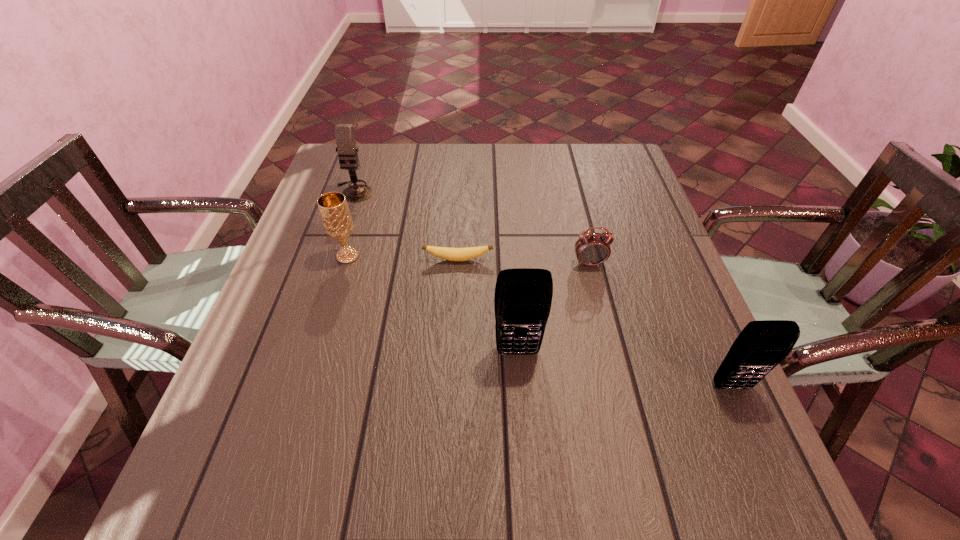
This screenshot has width=960, height=540. Find the location of `free spot between the microphone and the banana`. free spot between the microphone and the banana is located at coordinates (406, 225).

Where is `free point between the farther cellular telephone and the second object from right to left`? The width and height of the screenshot is (960, 540). free point between the farther cellular telephone and the second object from right to left is located at coordinates (554, 308).

The width and height of the screenshot is (960, 540). What are the coordinates of `vacant space that's between the taller cellular telephone and the right cellular telephone` in the screenshot? It's located at (625, 369).

Locate an element on the screen. empty location between the microphone and the farther cellular telephone is located at coordinates (436, 272).

Locate which object is the closest to the chalice. Please provide its 2D coordinates. Your answer should be formatted as a tuple, i.e. [(x, y)], where the tuple contains the x and y coordinates of a point satisfying the conditions above.

[(452, 254)]

Identify which object is the closest to the microphone. Please provide its 2D coordinates. Your answer should be formatted as a tuple, i.e. [(x, y)], where the tuple contains the x and y coordinates of a point satisfying the conditions above.

[(336, 218)]

The width and height of the screenshot is (960, 540). I want to click on free region that satisfies the following two spatial constraints: 1. on the front-facing side of the microphone; 2. on the left side of the chalice, so click(x=332, y=256).